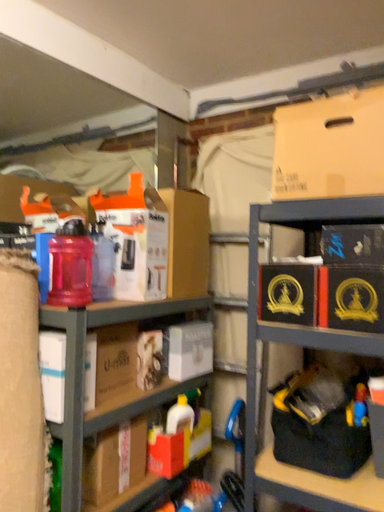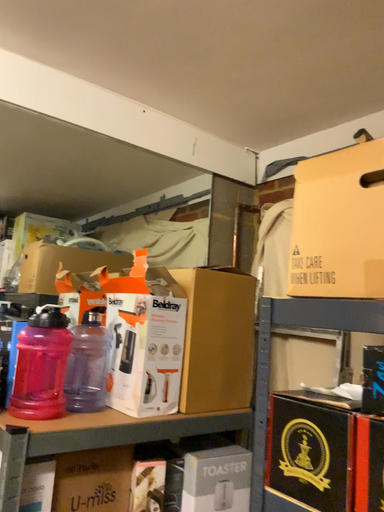
Question: How did the camera likely rotate when shooting the video?

Choices:
 (A) rotated right
 (B) rotated left

Answer: (B)